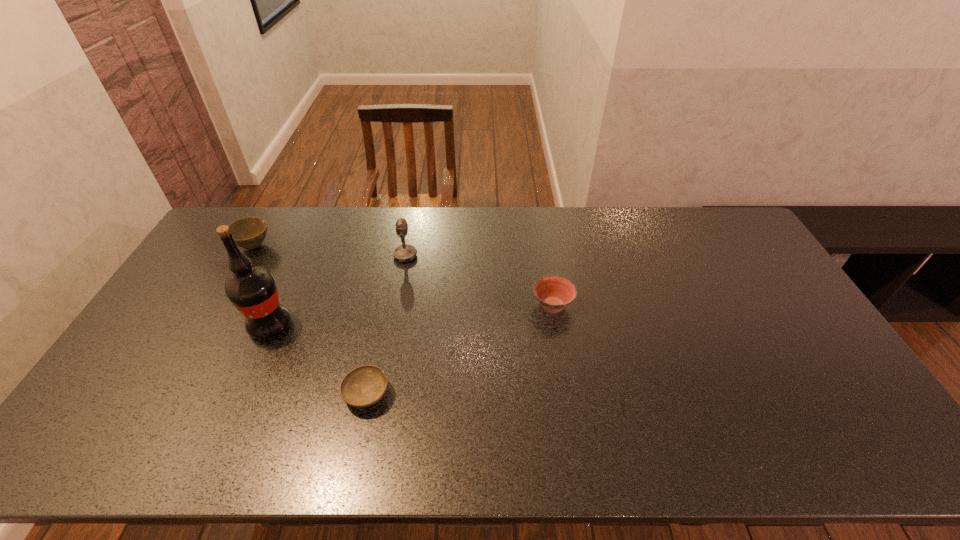
I want to click on free space located 0.070m on the front-facing side of the fourth shortest object, so click(x=438, y=256).

I want to click on vacant space located on the back of the leftmost bowl, so click(x=272, y=215).

The image size is (960, 540). I want to click on free space located 0.100m on the back of the rightmost bowl, so click(546, 269).

At what (x,y) coordinates should I click in order to perform the action: click on vacant space located 0.350m on the right of the shortest object. Please return your answer as a coordinate pair (x, y). This screenshot has height=540, width=960. Looking at the image, I should click on (525, 394).

Where is `object that is at the far edge`? object that is at the far edge is located at coordinates (249, 233).

Find the location of a particular element. This screenshot has height=540, width=960. object situated at the left edge is located at coordinates (249, 233).

The height and width of the screenshot is (540, 960). I want to click on object that is at the far left corner, so click(249, 233).

Where is `free space at the far edge of the desktop`? The height and width of the screenshot is (540, 960). free space at the far edge of the desktop is located at coordinates (300, 244).

Identify the location of free space at the near edge. The height and width of the screenshot is (540, 960). (442, 444).

Locate an element on the screen. This screenshot has width=960, height=540. vacant region at the left edge of the desktop is located at coordinates (149, 328).